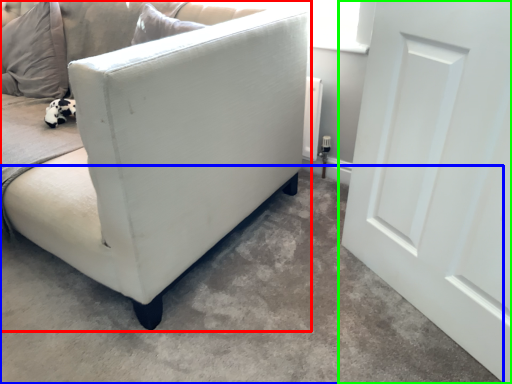
Question: Which is farther away from studio couch (highlighted by a red box)? concrete (highlighted by a blue box) or door (highlighted by a green box)?

Choices:
 (A) concrete
 (B) door

Answer: (B)